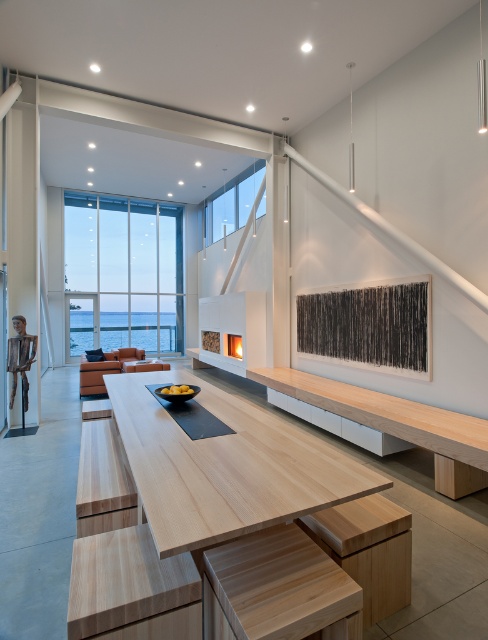
You are planning to place a large potted plant on the light wood table at center. However, you need to ensure it won t block the heat from the matte white fireplace at center. Based on their positions, is this placement feasible?

The light wood table at center is positioned under the matte white fireplace at center. Placing a large potted plant on the table might block the heat from the fireplace, so it is not advisable to place the plant there.

You are arranging chairs around the light wood table at center and the light brown wood stool at lower center. According to their positions, which object should you place your chair closer to if you want it to be on the right side of the setup?

You should place your chair closer to the light brown wood stool at lower center because the light wood table at center is positioned on the left side of it.